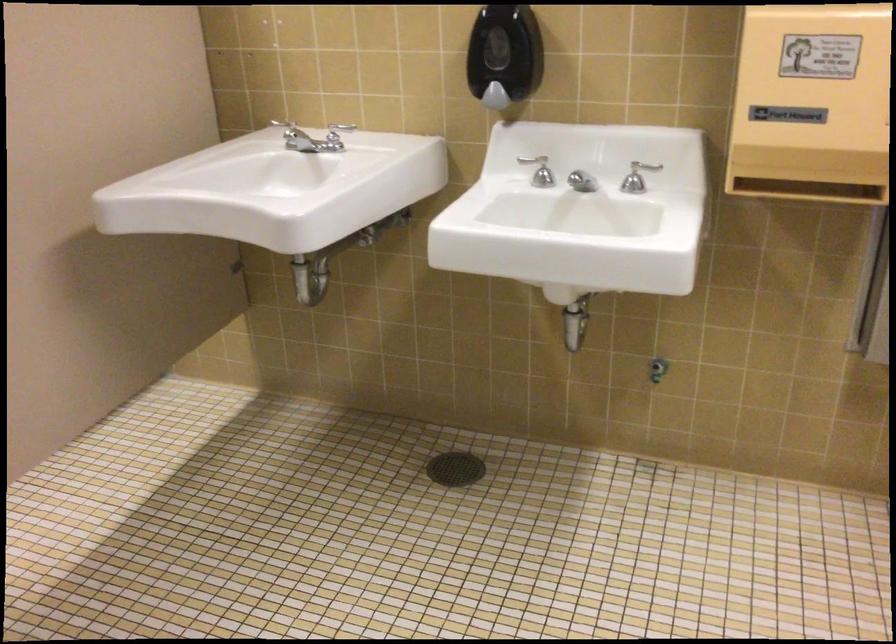
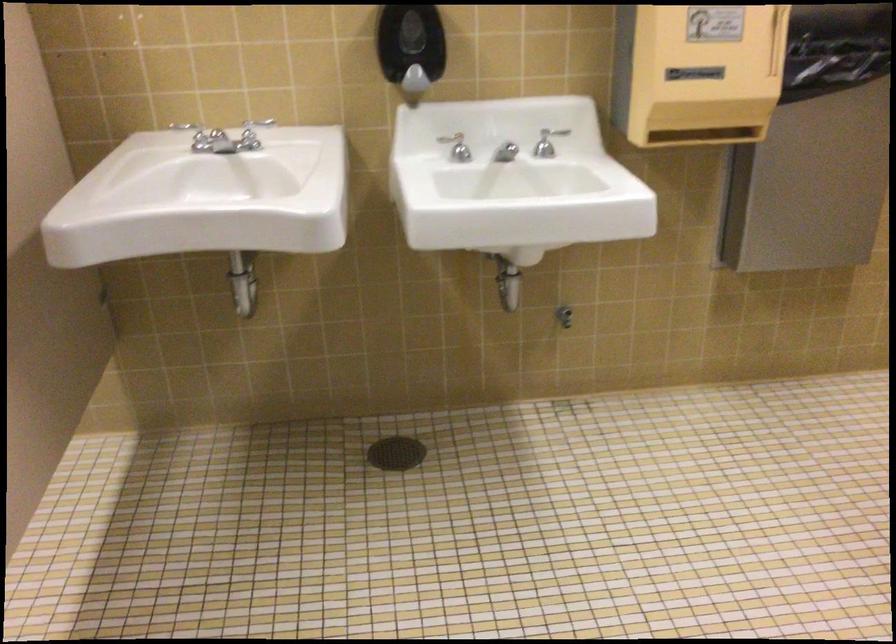
Where in the second image is the point corresponding to (x=314, y=131) from the first image?

(194, 135)